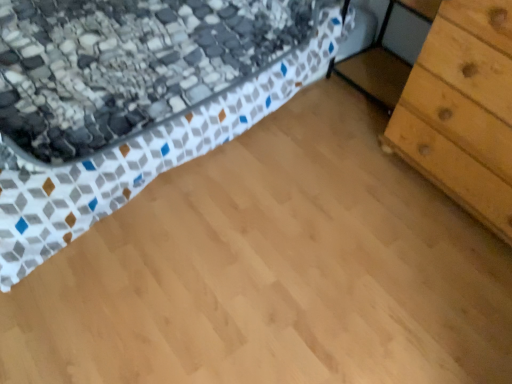
Question: Looking at the image, does textured fabric bed at upper left seem bigger or smaller compared to light brown wood chest of drawers at right?

Choices:
 (A) big
 (B) small

Answer: (A)

Question: Looking at their shapes, would you say textured fabric bed at upper left is wider or thinner than light brown wood chest of drawers at right?

Choices:
 (A) thin
 (B) wide

Answer: (B)

Question: Is textured fabric bed at upper left situated inside light brown wood chest of drawers at right or outside?

Choices:
 (A) inside
 (B) outside

Answer: (B)

Question: From the image's perspective, is light brown wood chest of drawers at right located above or below textured fabric bed at upper left?

Choices:
 (A) below
 (B) above

Answer: (A)

Question: Would you say light brown wood chest of drawers at right is to the left or to the right of textured fabric bed at upper left in the picture?

Choices:
 (A) left
 (B) right

Answer: (B)

Question: Is point (460, 11) positioned closer to the camera than point (274, 87)?

Choices:
 (A) closer
 (B) farther

Answer: (A)

Question: Is light brown wood chest of drawers at right inside or outside of textured fabric bed at upper left?

Choices:
 (A) inside
 (B) outside

Answer: (B)